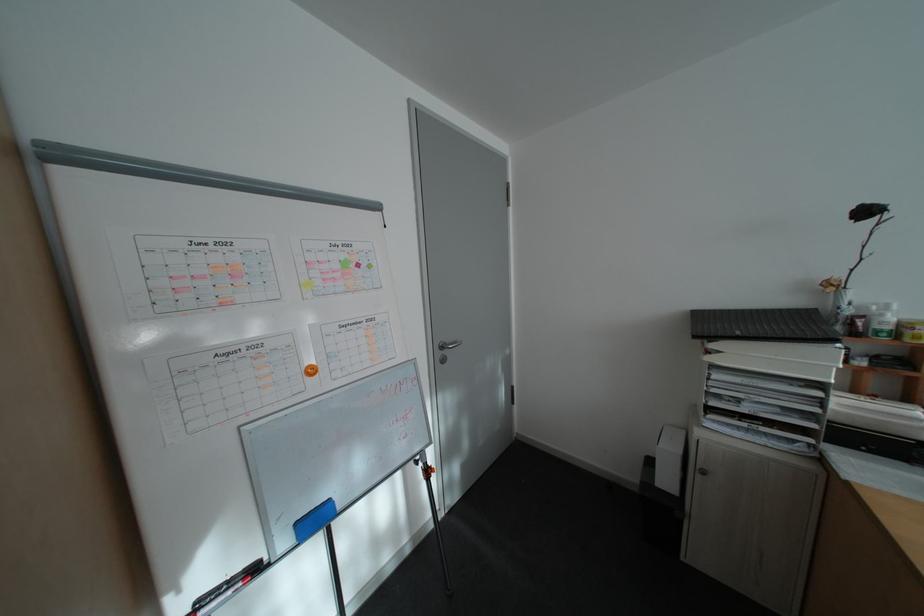
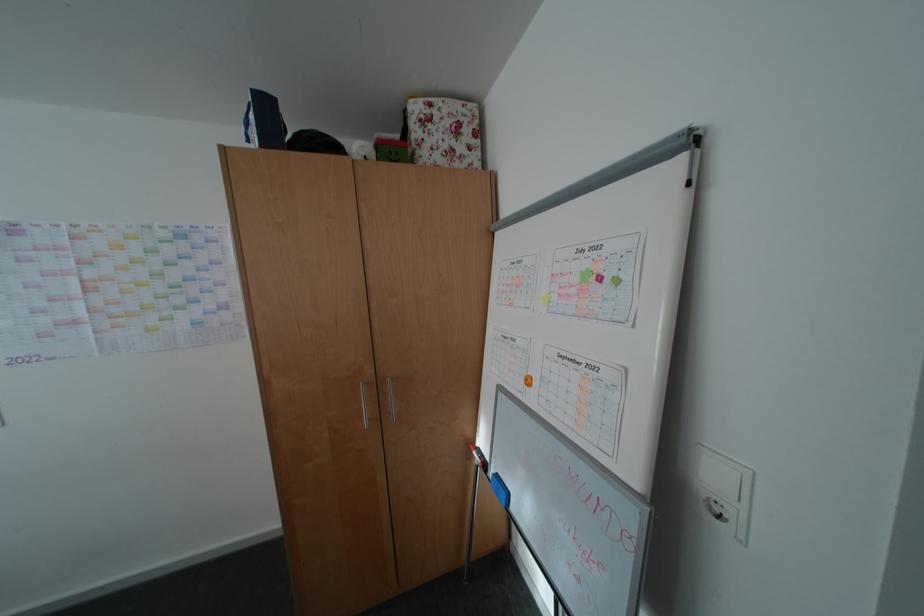
Find the pixel in the second image that matches point 330,293 in the first image.

(563, 309)